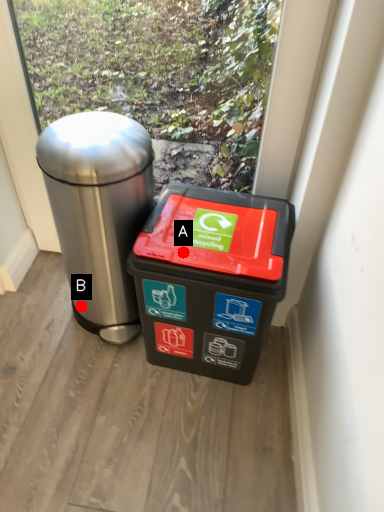
Question: Two points are circled on the image, labeled by A and B beside each circle. Which point is closer to the camera?

Choices:
 (A) A is closer
 (B) B is closer

Answer: (A)